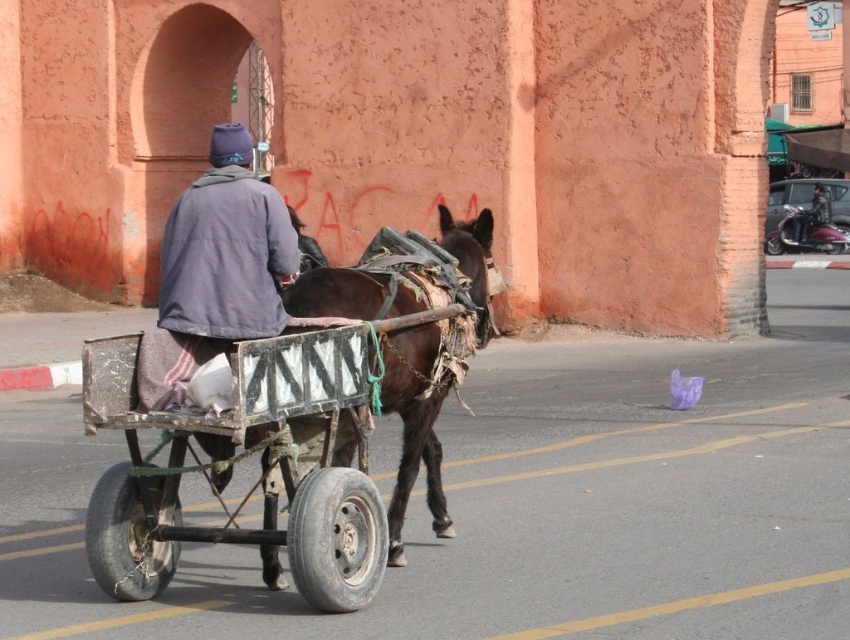
You are a pedestrian standing on the street. You see the rusty metal cart at center and the metallic helmet at upper right. Which object is nearer to you?

The rusty metal cart at center is closer to the viewer than the metallic helmet at upper right.

You are a pedestrian on the street and see the rusty metal cart at center and the brown leather donkey at center. Which one is more to the left?

The rusty metal cart at center is positioned on the left side of brown leather donkey at center, so the rusty metal cart at center is more to the left.

You are a pedestrian standing on the sidewalk. You see a brown leather donkey at center and a metallic helmet at upper right. Which object is closer to the ground?

The brown leather donkey at center is closer to the ground because it is positioned below the metallic helmet at upper right.